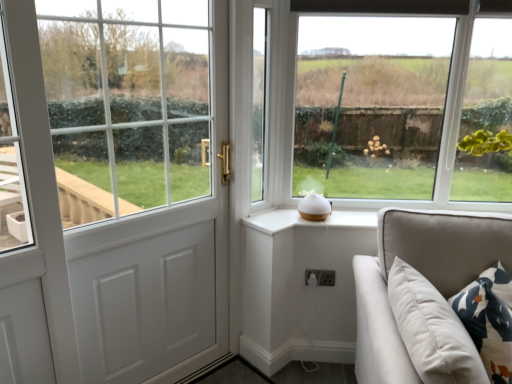
Question: Does point (283, 190) appear closer or farther from the camera than point (446, 228)?

Choices:
 (A) closer
 (B) farther

Answer: (B)

Question: Considering the positions of white glass window at center, which is the 2th window from right to left, and beige fabric couch at lower right in the image, is white glass window at center, which is the 2th window from right to left, taller or shorter than beige fabric couch at lower right?

Choices:
 (A) tall
 (B) short

Answer: (A)

Question: Which object is the closest to the white glass window at center, the 2th window viewed from the left?

Choices:
 (A) green leafy plant at upper right, which appears as the third window when viewed from the left
 (B) beige fabric couch at lower right
 (C) white glass door at left, arranged as the 1th window when viewed from the left
 (D) white plastic electric outlet at lower center

Answer: (C)

Question: Which of these objects is positioned farthest from the white plastic electric outlet at lower center?

Choices:
 (A) beige fabric couch at lower right
 (B) white glass door at left, arranged as the 1th window when viewed from the left
 (C) white glass window at center, the 2th window viewed from the left
 (D) green leafy plant at upper right, which appears as the third window when viewed from the left

Answer: (B)